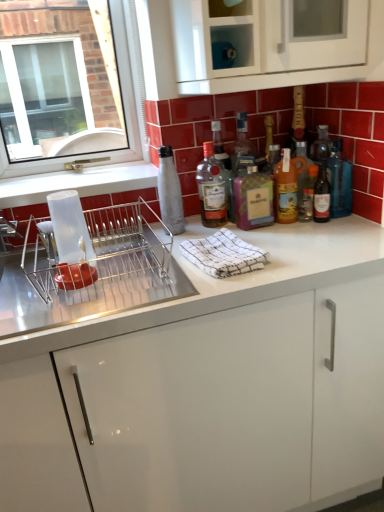
Question: Does translucent amber bottle at center, placed as the third bottle when sorted from right to left, lie behind white glossy cabinet at center, arranged as the first cabinetry when ordered from the bottom?

Choices:
 (A) no
 (B) yes

Answer: (B)

Question: Is translucent amber bottle at center, which appears as the fourth bottle when viewed from the left, with white glossy cabinet at center, arranged as the first cabinetry when ordered from the bottom?

Choices:
 (A) no
 (B) yes

Answer: (A)

Question: Is translucent amber bottle at center, which appears as the fourth bottle when viewed from the left, taller than white glossy cabinet at center, arranged as the first cabinetry when ordered from the bottom?

Choices:
 (A) no
 (B) yes

Answer: (A)

Question: From a real-world perspective, is translucent amber bottle at center, placed as the third bottle when sorted from right to left, physically above white glossy cabinet at center, arranged as the second cabinetry when viewed from the top?

Choices:
 (A) yes
 (B) no

Answer: (A)

Question: Is translucent amber bottle at center, which appears as the fourth bottle when viewed from the left, oriented away from white glossy cabinet at center, arranged as the first cabinetry when ordered from the bottom?

Choices:
 (A) no
 (B) yes

Answer: (A)

Question: Considering the positions of white glossy cabinet at upper center, placed as the 1th cabinetry when sorted from top to bottom, and metallic silver dish rack at left in the image, is white glossy cabinet at upper center, placed as the 1th cabinetry when sorted from top to bottom, wider or thinner than metallic silver dish rack at left?

Choices:
 (A) wide
 (B) thin

Answer: (B)

Question: From the image's perspective, is white glossy cabinet at upper center, placed as the 1th cabinetry when sorted from top to bottom, above or below metallic silver dish rack at left?

Choices:
 (A) above
 (B) below

Answer: (A)

Question: Is white glossy cabinet at upper center, placed as the 1th cabinetry when sorted from top to bottom, taller or shorter than metallic silver dish rack at left?

Choices:
 (A) short
 (B) tall

Answer: (B)

Question: Considering the relative positions of white glossy cabinet at upper center, placed as the 1th cabinetry when sorted from top to bottom, and metallic silver dish rack at left in the image provided, is white glossy cabinet at upper center, placed as the 1th cabinetry when sorted from top to bottom, to the left or to the right of metallic silver dish rack at left?

Choices:
 (A) left
 (B) right

Answer: (B)

Question: From a real-world perspective, is matte glass bottle at center, the 3th bottle in the left-to-right sequence, positioned above or below metallic silver dish rack at left?

Choices:
 (A) above
 (B) below

Answer: (A)

Question: Considering the positions of matte glass bottle at center, the 3th bottle in the left-to-right sequence, and metallic silver dish rack at left in the image, is matte glass bottle at center, the 3th bottle in the left-to-right sequence, wider or thinner than metallic silver dish rack at left?

Choices:
 (A) thin
 (B) wide

Answer: (A)

Question: From the image's perspective, is matte glass bottle at center, the 3th bottle in the left-to-right sequence, above or below metallic silver dish rack at left?

Choices:
 (A) above
 (B) below

Answer: (A)

Question: Considering the relative positions of matte glass bottle at center, the 4th bottle when ordered from right to left, and metallic silver dish rack at left in the image provided, is matte glass bottle at center, the 4th bottle when ordered from right to left, to the left or to the right of metallic silver dish rack at left?

Choices:
 (A) right
 (B) left

Answer: (A)

Question: Looking at their shapes, would you say metallic silver dish rack at left is wider or thinner than white glossy cabinet at upper center, the 2th cabinetry ordered from the bottom?

Choices:
 (A) thin
 (B) wide

Answer: (B)

Question: Relative to white glossy cabinet at upper center, the 2th cabinetry ordered from the bottom, is metallic silver dish rack at left in front or behind?

Choices:
 (A) front
 (B) behind

Answer: (A)